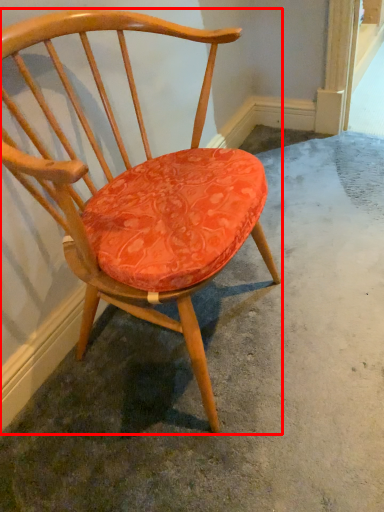
Question: From the image's perspective, considering the relative positions of chair (annotated by the red box) and concrete in the image provided, where is chair (annotated by the red box) located with respect to the staircase?

Choices:
 (A) below
 (B) above

Answer: (B)